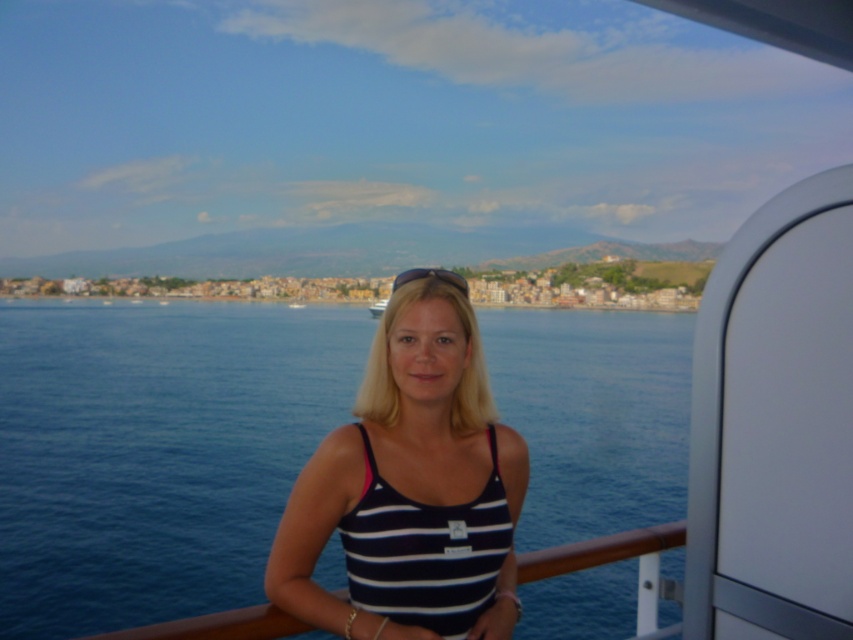
You are standing on the boat and want to reach a specific point marked at coordinates point (57, 593). If your maximum walking distance is 100 feet, can you comfortably walk to that point without needing assistance?

The distance of point (57, 593) from viewer is 93.86 feet, which is within your maximum walking distance of 100 feet. Therefore, you can comfortably walk to that point without needing assistance.

You are a photographer trying to capture the blue liquid water at center and the white striped tank top at center in the same frame. Based on their positions and sizes, which object would appear larger in the photo?

The blue liquid water at center might be wider than the white striped tank top at center, so it would likely appear larger in the photo.